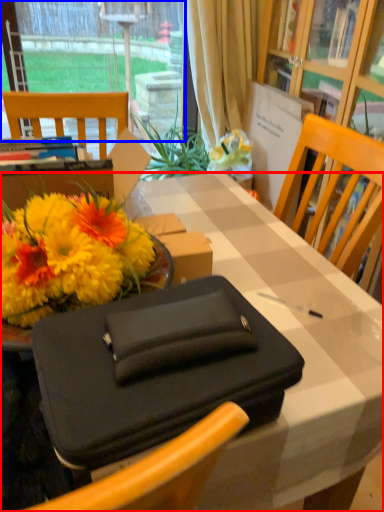
Question: Which object is further to the camera taking this photo, desk (highlighted by a red box) or window (highlighted by a blue box)?

Choices:
 (A) desk
 (B) window

Answer: (B)